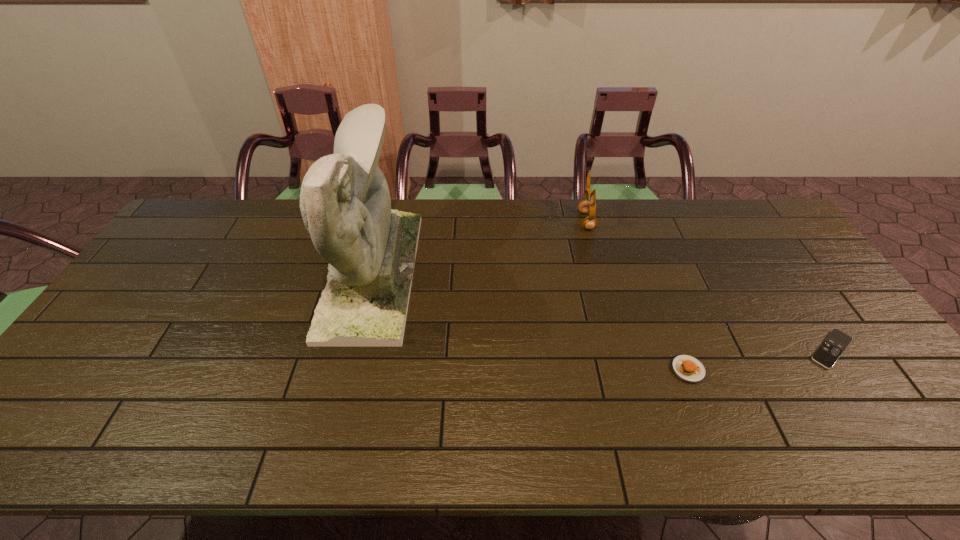
You are a GUI agent. You are given a task and a screenshot of the screen. Output one action in this format:
    pyautogui.click(x=<x>, y=<y>)
    Task: Click on the vacant position in the image that satisfies the following two spatial constraints: 1. on the base of the sculpture; 2. on the right side of the second object from right to left
    This screenshot has width=960, height=540.
    Given the screenshot: What is the action you would take?
    pyautogui.click(x=349, y=369)

Locate an element on the screen. vacant space that satisfies the following two spatial constraints: 1. on the back side of the second object from right to left; 2. on the base of the leftmost object is located at coordinates (650, 273).

Where is `vacant space that satisfies the following two spatial constraints: 1. on the front-facing side of the second tallest object; 2. on the right side of the food`? vacant space that satisfies the following two spatial constraints: 1. on the front-facing side of the second tallest object; 2. on the right side of the food is located at coordinates (627, 369).